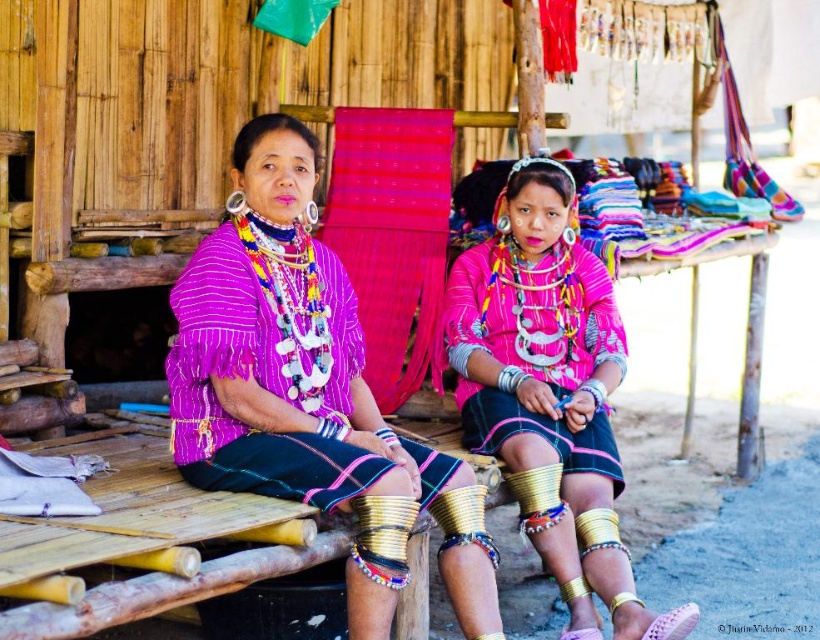
You are a tailor who needs to determine which item has a greater width between the matte purple blouse at center and the pink matte fabric at center. Based on the scene, which one is wider?

The matte purple blouse at center is wider than the pink matte fabric at center according to the description.

You are an assistant helping to organize a cultural fashion show. You need to determine which garment is shorter between the matte purple blouse at center and the pink matte fabric at center. Which one should you report?

The matte purple blouse at center is shorter than the pink matte fabric at center.

You are an artist trying to replicate this traditional scene. You notice two central elements in the image, the matte purple blouse at center and the pink matte fabric at center. Which one is located to the left of the other?

The matte purple blouse at center is positioned on the left side of the pink matte fabric at center.